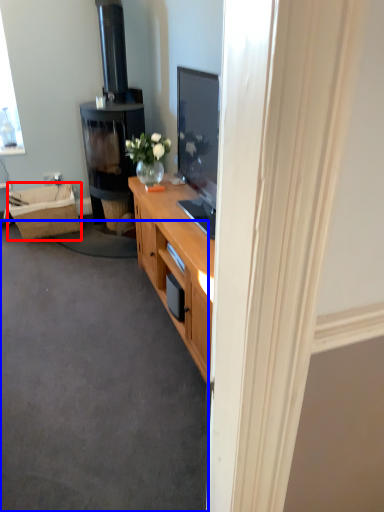
Question: Among these objects, which one is farthest to the camera, picnic basket (highlighted by a red box) or plain (highlighted by a blue box)?

Choices:
 (A) picnic basket
 (B) plain

Answer: (A)